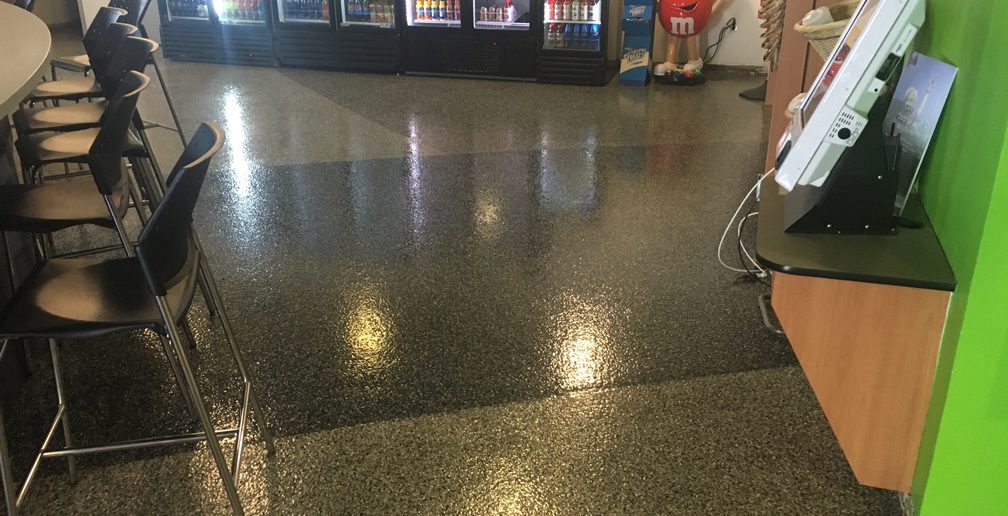
Locate an element on the screen. chairs is located at coordinates (x=103, y=310), (x=68, y=192), (x=74, y=85), (x=79, y=58).